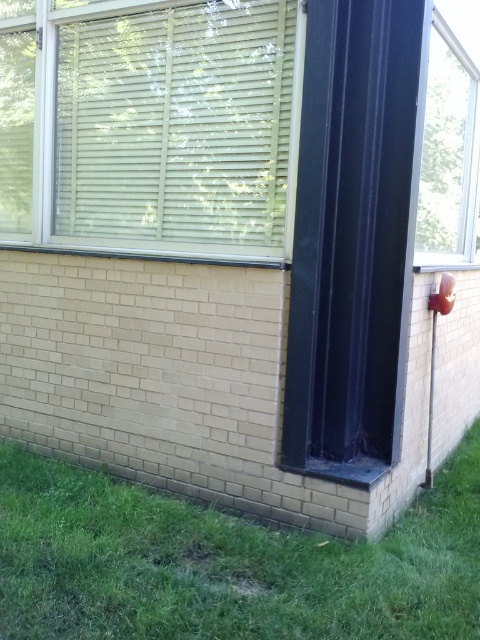
Does white plastic blinds at upper left have a lesser width compared to clear glass window at upper right?

Incorrect, white plastic blinds at upper left's width is not less than clear glass window at upper right's.

This screenshot has height=640, width=480. What do you see at coordinates (176, 124) in the screenshot?
I see `white plastic blinds at upper left` at bounding box center [176, 124].

What do you see at coordinates (176, 124) in the screenshot? The width and height of the screenshot is (480, 640). I see `white plastic blinds at upper left` at bounding box center [176, 124].

The width and height of the screenshot is (480, 640). Find the location of `white plastic blinds at upper left`. white plastic blinds at upper left is located at coordinates (176, 124).

Between green grass at lower left and clear glass window at upper right, which one has more height?

Standing taller between the two is clear glass window at upper right.

Which is above, green grass at lower left or clear glass window at upper right?

clear glass window at upper right

Does point (470, 564) come farther from viewer compared to point (441, 112)?

No, it is in front of (441, 112).

The image size is (480, 640). Find the location of `green grass at lower left`. green grass at lower left is located at coordinates (227, 563).

Does point (158, 560) lie behind point (194, 225)?

No, (158, 560) is closer to viewer.

Find the location of `green grass at lower left`. green grass at lower left is located at coordinates (227, 563).

You are a GUI agent. You are given a task and a screenshot of the screen. Output one action in this format:
    pyautogui.click(x=<x>, y=<y>)
    Task: Click on the green grass at lower left
    This screenshot has width=480, height=640.
    Given the screenshot: What is the action you would take?
    pyautogui.click(x=227, y=563)

Locate an element on the screen. Image resolution: width=480 pixels, height=640 pixels. green grass at lower left is located at coordinates (227, 563).